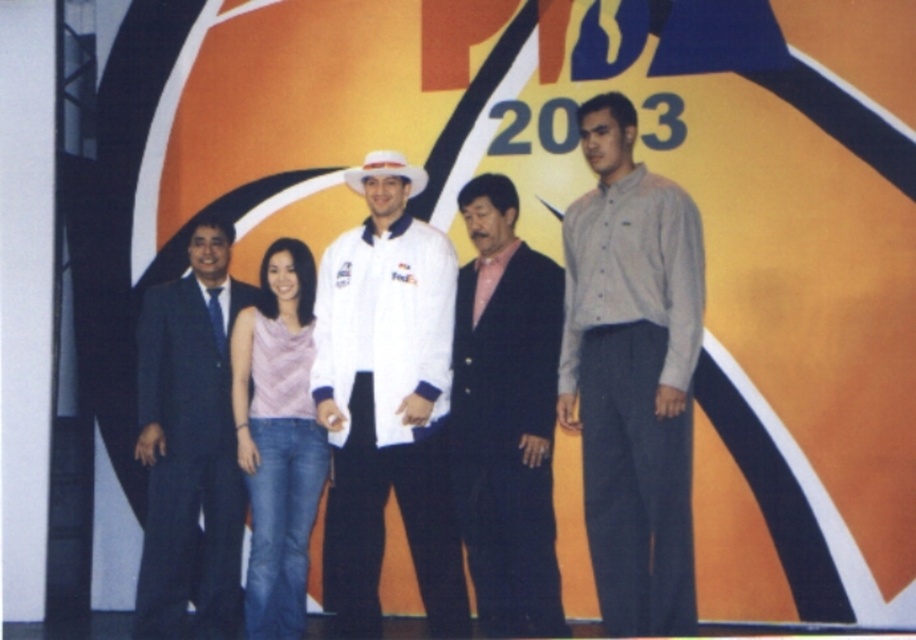
You are organizing a photo shoot and need to ensure that the white matte jacket at center and the pink fabric top at center are visible in the frame. Given that the camera has a limited focus range, which item should you prioritize to ensure it is in focus first?

The white matte jacket at center has a larger size compared to the pink fabric top at center, so you should prioritize focusing on the white matte jacket at center first to ensure its visibility.

You are standing in front of the group and want to greet the person wearing the dark blue suit at left and the person in the pink fabric top at center. Which one do you need to step forward to approach first?

You need to step forward to approach the dark blue suit at left first because it is closer to you than the pink fabric top at center.